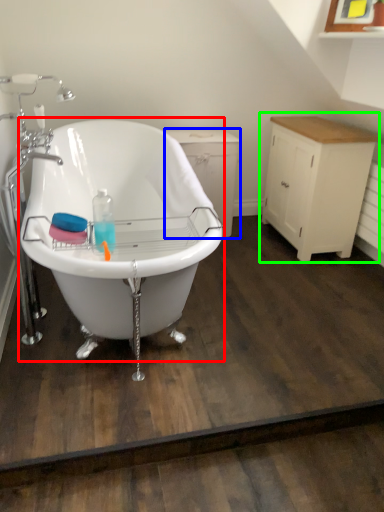
Question: Considering the real-world distances, which object is closest to bathtub (highlighted by a red box)? dresser (highlighted by a blue box) or cabinetry (highlighted by a green box).

Choices:
 (A) dresser
 (B) cabinetry

Answer: (A)